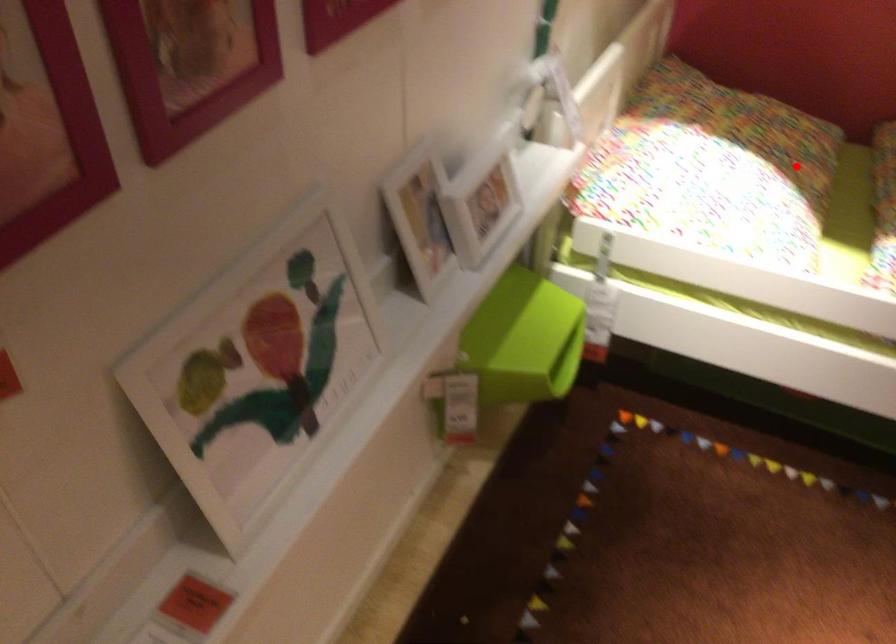
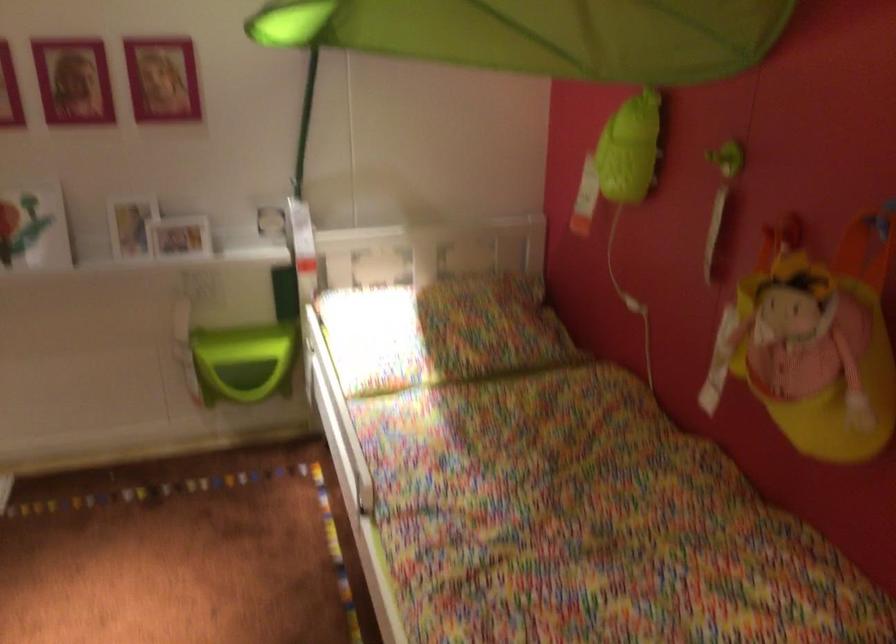
Question: I am providing you with two images of the same scene from different viewpoints. A red point is shown in image1. For the corresponding object point in image2, is it positioned nearer or farther from the camera?

Choices:
 (A) Nearer
 (B) Farther

Answer: (B)